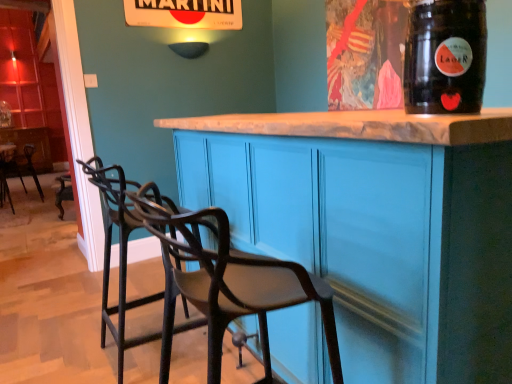
Question: From a real-world perspective, is black metal bar stool at lower left, which is counted as the 2th chair, starting from the front, on top of transparent plastic straw at upper right?

Choices:
 (A) yes
 (B) no

Answer: (B)

Question: Is the surface of black metal bar stool at lower left, which is counted as the 2th chair, starting from the front, in direct contact with transparent plastic straw at upper right?

Choices:
 (A) no
 (B) yes

Answer: (A)

Question: Is black metal bar stool at lower left, which is counted as the 2th chair, starting from the front, further to camera compared to transparent plastic straw at upper right?

Choices:
 (A) yes
 (B) no

Answer: (A)

Question: Can you confirm if black metal bar stool at lower left, acting as the second chair starting from the left, is positioned to the right of transparent plastic straw at upper right?

Choices:
 (A) yes
 (B) no

Answer: (B)

Question: From the image's perspective, is black metal bar stool at lower left, which is the second chair in right-to-left order, above transparent plastic straw at upper right?

Choices:
 (A) yes
 (B) no

Answer: (B)

Question: Is point (478, 44) closer or farther from the camera than point (31, 147)?

Choices:
 (A) closer
 (B) farther

Answer: (A)

Question: Is transparent plastic straw at upper right in front of or behind black metal chair at left, which is the 1th chair in back-to-front order, in the image?

Choices:
 (A) behind
 (B) front

Answer: (B)

Question: Which is correct: transparent plastic straw at upper right is inside black metal chair at left, marked as the 3th chair in a front-to-back arrangement, or outside of it?

Choices:
 (A) outside
 (B) inside

Answer: (A)

Question: Looking at the image, does transparent plastic straw at upper right seem bigger or smaller compared to black metal chair at left, marked as the 3th chair in a front-to-back arrangement?

Choices:
 (A) small
 (B) big

Answer: (A)

Question: From the image's perspective, relative to matte blue cabinet at center, is black metal bar stool at lower left, acting as the second chair starting from the left, above or below?

Choices:
 (A) below
 (B) above

Answer: (A)

Question: Visually, is black metal bar stool at lower left, acting as the second chair starting from the left, positioned to the left or to the right of matte blue cabinet at center?

Choices:
 (A) right
 (B) left

Answer: (B)

Question: Is black metal bar stool at lower left, which is the second chair in right-to-left order, wider or thinner than matte blue cabinet at center?

Choices:
 (A) wide
 (B) thin

Answer: (B)

Question: Is point (189, 329) positioned closer to the camera than point (391, 216)?

Choices:
 (A) closer
 (B) farther

Answer: (B)

Question: Is point (426, 104) positioned closer to the camera than point (445, 175)?

Choices:
 (A) farther
 (B) closer

Answer: (B)

Question: Is transparent plastic straw at upper right in front of or behind matte blue cabinet at center in the image?

Choices:
 (A) behind
 (B) front

Answer: (A)